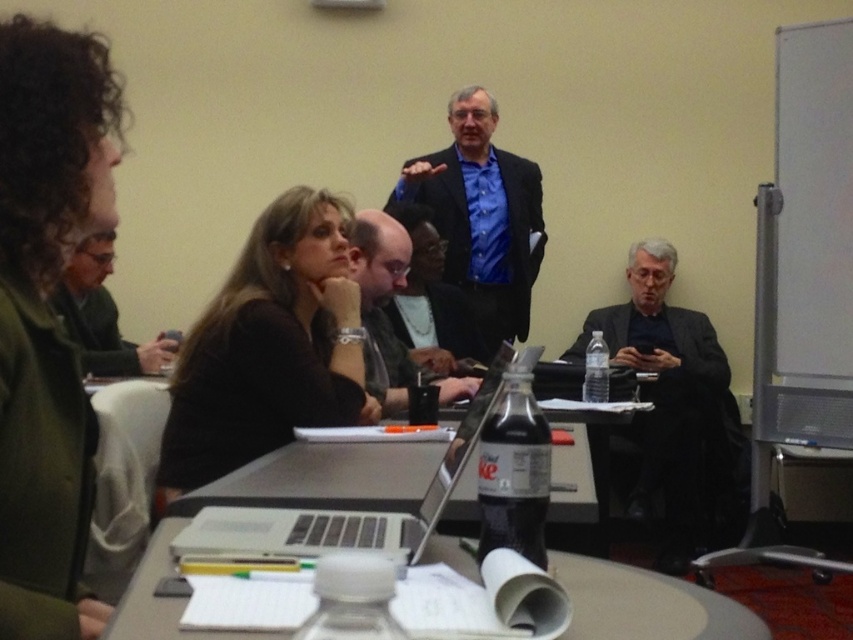
Question: Does blue matte shirt at center have a smaller size compared to green sweater at left?

Choices:
 (A) no
 (B) yes

Answer: (A)

Question: Does black matte shirt at center have a lesser width compared to silver metallic laptop at center?

Choices:
 (A) no
 (B) yes

Answer: (A)

Question: Is black matte suit at right closer to the viewer compared to silver metallic laptop at center?

Choices:
 (A) yes
 (B) no

Answer: (B)

Question: Among these points, which one is nearest to the camera?

Choices:
 (A) (265, 525)
 (B) (53, 301)

Answer: (A)

Question: Which point is farther to the camera?

Choices:
 (A) black matte shirt at center
 (B) green sweater at left
 (C) clear plastic bottle at center
 (D) matte black laptop at center

Answer: (B)

Question: Which of the following is the closest to the observer?

Choices:
 (A) green sweater at left
 (B) matte black laptop at center
 (C) black matte shirt at center

Answer: (C)